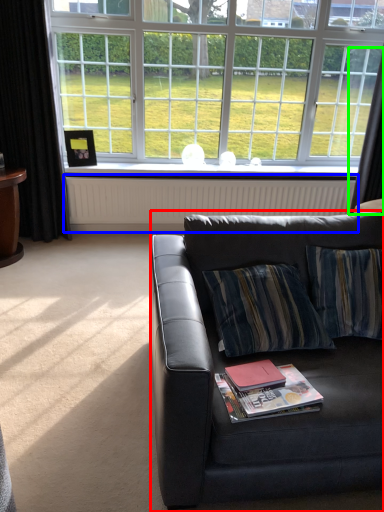
Question: Estimate the real-world distances between objects in this image. Which object is farther from studio couch (highlighted by a red box), radiator (highlighted by a blue box) or curtain (highlighted by a green box)?

Choices:
 (A) radiator
 (B) curtain

Answer: (B)